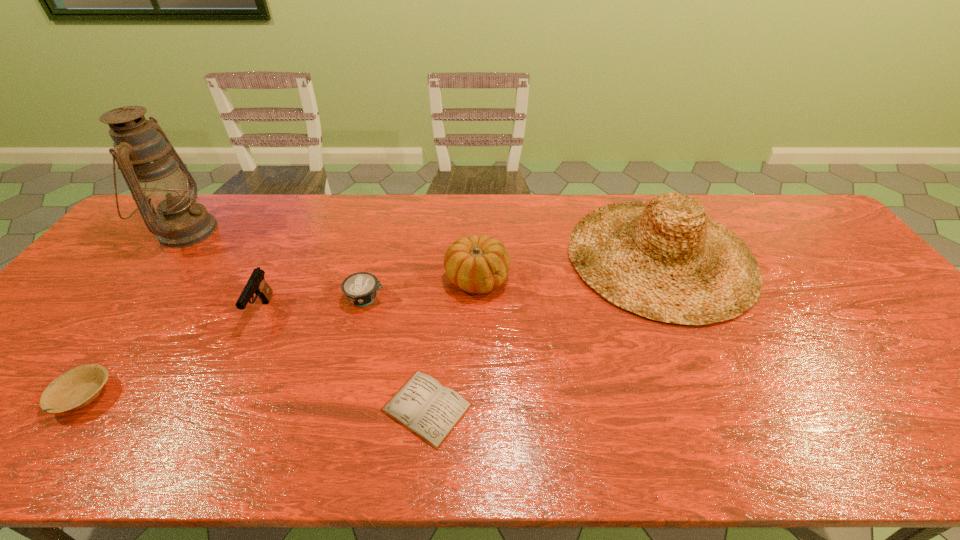
At what (x,y) coordinates should I click in order to perform the action: click on unoccupied position between the second tallest object and the yogurt. Please return your answer as a coordinate pair (x, y). The image size is (960, 540). Looking at the image, I should click on (514, 277).

Identify the location of empty location between the fifth object from right to left and the tallest object. Image resolution: width=960 pixels, height=540 pixels. (224, 271).

Identify the location of vacant area between the rightmost object and the oil lamp. The image size is (960, 540). (423, 244).

You are a GUI agent. You are given a task and a screenshot of the screen. Output one action in this format:
    pyautogui.click(x=<x>, y=<y>)
    Task: Click on the blank region between the rightmost object and the oil lamp
    Image resolution: width=960 pixels, height=540 pixels.
    Given the screenshot: What is the action you would take?
    [x=423, y=244]

Where is `free space between the pistol and the bowl`? This screenshot has width=960, height=540. free space between the pistol and the bowl is located at coordinates (173, 354).

The image size is (960, 540). Find the location of `free space that is in between the yogurt and the sixth shortest object`. free space that is in between the yogurt and the sixth shortest object is located at coordinates (514, 277).

Point out which object is positioned as the second nearest to the pistol. Please provide its 2D coordinates. Your answer should be formatted as a tuple, i.e. [(x, y)], where the tuple contains the x and y coordinates of a point satisfying the conditions above.

[(78, 387)]

Where is `object that is the second nearest to the fifth object from right to left`? This screenshot has width=960, height=540. object that is the second nearest to the fifth object from right to left is located at coordinates (78, 387).

Identify the location of free space that satisfies the following two spatial constraints: 1. on the back side of the gourd; 2. on the left side of the second tallest object. This screenshot has height=540, width=960. (477, 256).

Locate an element on the screen. The width and height of the screenshot is (960, 540). free space that satisfies the following two spatial constraints: 1. on the back side of the gourd; 2. on the right side of the fourth object from left to right is located at coordinates (371, 279).